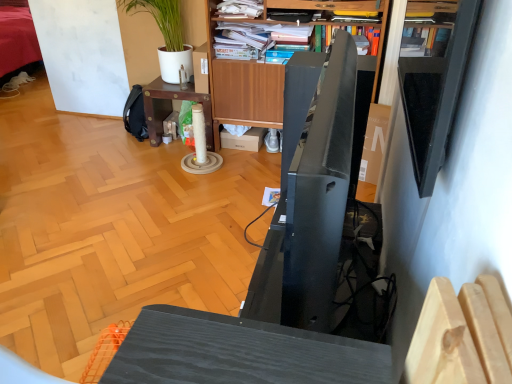
I want to click on green matte plant at upper left, so click(139, 45).

Is green matte plant at upper left situated inside hardcover book at upper center or outside?

green matte plant at upper left is located beyond the bounds of hardcover book at upper center.

Considering the sizes of green matte plant at upper left and hardcover book at upper center in the image, is green matte plant at upper left wider or thinner than hardcover book at upper center?

Clearly, green matte plant at upper left has less width compared to hardcover book at upper center.

From a real-world perspective, is green matte plant at upper left above or below hardcover book at upper center?

In terms of real-world spatial position, green matte plant at upper left is below hardcover book at upper center.

From the picture: Is green matte plant at upper left oriented towards hardcover book at upper center?

No, green matte plant at upper left is not aimed at hardcover book at upper center.

Would you say wooden bookshelf at upper center is to the left or to the right of wooden bookcase at upper center in the picture?

Based on their positions, wooden bookshelf at upper center is located to the left of wooden bookcase at upper center.

Is wooden bookshelf at upper center inside the boundaries of wooden bookcase at upper center, or outside?

wooden bookshelf at upper center can be found inside wooden bookcase at upper center.

Considering the points (231, 8) and (386, 13), which point is behind, point (231, 8) or point (386, 13)?

Positioned behind is point (231, 8).

From a real-world perspective, between wooden bookshelf at upper center and wooden bookcase at upper center, who is vertically lower?

wooden bookcase at upper center is physically lower.

Looking at this image, is wooden bookcase at upper center taller or shorter than hardcover book at upper center?

Clearly, wooden bookcase at upper center is taller compared to hardcover book at upper center.

From the image's perspective, is wooden bookcase at upper center under hardcover book at upper center?

Correct, wooden bookcase at upper center appears lower than hardcover book at upper center in the image.

Between wooden bookcase at upper center and hardcover book at upper center, which one has smaller width?

hardcover book at upper center is thinner.

Looking at this image, is wooden bookcase at upper center facing towards hardcover book at upper center?

Result: Yes, wooden bookcase at upper center faces towards hardcover book at upper center.

Is wooden desk at center spatially inside hardcover book at upper center, or outside of it?

wooden desk at center cannot be found inside hardcover book at upper center.

Considering their positions, is wooden desk at center located in front of or behind hardcover book at upper center?

Clearly, wooden desk at center is behind hardcover book at upper center.

Considering the sizes of wooden desk at center and hardcover book at upper center in the image, is wooden desk at center bigger or smaller than hardcover book at upper center?

Considering their sizes, wooden desk at center takes up more space than hardcover book at upper center.

From the image's perspective, between wooden desk at center and hardcover book at upper center, which one is located above?

hardcover book at upper center is shown above in the image.

Is wooden desk at center with wooden bookcase at upper center?

No.

Consider the image. Considering the sizes of objects wooden desk at center and wooden bookcase at upper center in the image provided, who is wider, wooden desk at center or wooden bookcase at upper center?

With larger width is wooden desk at center.

Does wooden desk at center appear on the right side of wooden bookcase at upper center?

In fact, wooden desk at center is to the left of wooden bookcase at upper center.

Where is `bookcase that is in front of the wooden desk at center`? The width and height of the screenshot is (512, 384). bookcase that is in front of the wooden desk at center is located at coordinates (242, 87).

Considering the relative positions of green matte plant at upper left and wooden bookcase at upper center in the image provided, is green matte plant at upper left to the left of wooden bookcase at upper center from the viewer's perspective?

Correct, you'll find green matte plant at upper left to the left of wooden bookcase at upper center.

Who is bigger, green matte plant at upper left or wooden bookcase at upper center?

Bigger between the two is wooden bookcase at upper center.

Identify the location of houseplant lying on the left of wooden bookcase at upper center. The image size is (512, 384). (139, 45).

From the image's perspective, who appears lower, green matte plant at upper left or wooden bookcase at upper center?

wooden bookcase at upper center is shown below in the image.

You are a GUI agent. You are given a task and a screenshot of the screen. Output one action in this format:
    pyautogui.click(x=<x>, y=<y>)
    Task: Click on the bookcase below the wooden bookshelf at upper center (from the image's perspective)
    Image resolution: width=512 pixels, height=384 pixels.
    Given the screenshot: What is the action you would take?
    click(x=242, y=87)

Is wooden bookcase at upper center in contact with wooden bookshelf at upper center?

wooden bookcase at upper center and wooden bookshelf at upper center are clearly separated.

Is wooden bookcase at upper center looking in the opposite direction of wooden bookshelf at upper center?

Yes, wooden bookcase at upper center is positioned with its back facing wooden bookshelf at upper center.

You are a GUI agent. You are given a task and a screenshot of the screen. Output one action in this format:
    pyautogui.click(x=<x>, y=<y>)
    Task: Click on the book in front of the green matte plant at upper left
    The width and height of the screenshot is (512, 384).
    Given the screenshot: What is the action you would take?
    pyautogui.click(x=352, y=35)

Locate an element on the screen. The image size is (512, 384). shelf positioned vertically above the wooden bookcase at upper center (from a real-world perspective) is located at coordinates (240, 9).

Based on their spatial positions, is wooden bookcase at upper center or hardcover book at upper center further from green matte plant at upper left?

Among the two, hardcover book at upper center is located further to green matte plant at upper left.

Estimate the real-world distances between objects in this image. Which object is further from wooden bookshelf at upper center, hardcover book at upper center or wooden desk at center?

wooden desk at center is positioned further to the anchor wooden bookshelf at upper center.

When comparing their distances from green matte plant at upper left, does wooden bookcase at upper center or wooden desk at center seem further?

Among the two, wooden bookcase at upper center is located further to green matte plant at upper left.

Looking at the image, which one is located further to green matte plant at upper left, wooden desk at center or wooden bookshelf at upper center?

Among the two, wooden bookshelf at upper center is located further to green matte plant at upper left.

Looking at the image, which one is located further to green matte plant at upper left, wooden desk at center or hardcover book at upper center?

Among the two, hardcover book at upper center is located further to green matte plant at upper left.

Estimate the real-world distances between objects in this image. Which object is further from wooden bookshelf at upper center, hardcover book at upper center or wooden bookcase at upper center?

hardcover book at upper center lies further to wooden bookshelf at upper center than the other object.

When comparing their distances from wooden desk at center, does wooden bookcase at upper center or green matte plant at upper left seem further?

Based on the image, green matte plant at upper left appears to be further to wooden desk at center.

Based on their spatial positions, is wooden bookcase at upper center or hardcover book at upper center closer to wooden desk at center?

wooden bookcase at upper center is positioned closer to the anchor wooden desk at center.

Image resolution: width=512 pixels, height=384 pixels. I want to click on bookcase between wooden desk at center and hardcover book at upper center, so click(x=242, y=87).

Locate an element on the screen. This screenshot has height=384, width=512. bookcase located between green matte plant at upper left and hardcover book at upper center in the left-right direction is located at coordinates (242, 87).

Find the location of a particular element. shelf situated between wooden desk at center and wooden bookcase at upper center from left to right is located at coordinates (240, 9).

Locate an element on the screen. The height and width of the screenshot is (384, 512). shelf situated between green matte plant at upper left and wooden bookcase at upper center from left to right is located at coordinates (240, 9).